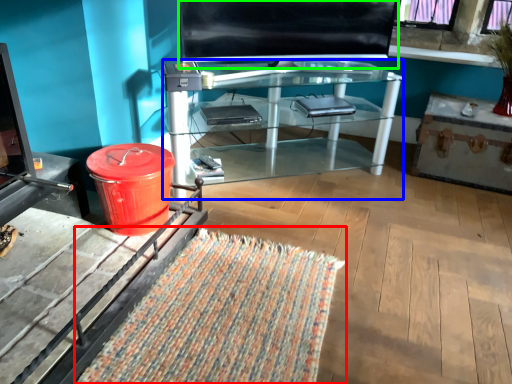
Question: Considering the real-world distances, which object is closest to mat (highlighted by a red box)? desk (highlighted by a blue box) or screen (highlighted by a green box).

Choices:
 (A) desk
 (B) screen

Answer: (A)